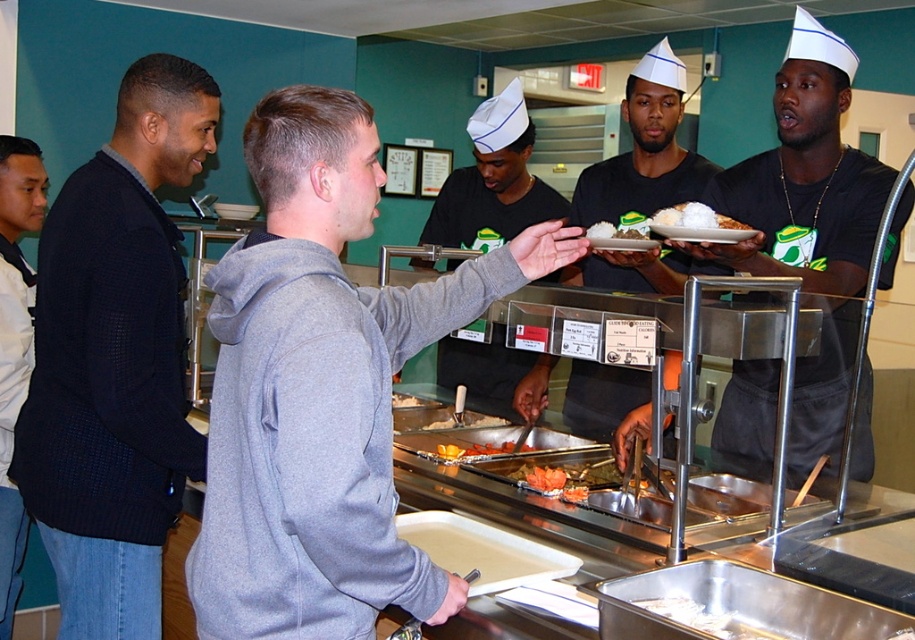
Which is above, orange glazed pastry at center or orange glazed carrots at center?

orange glazed pastry at center is above.

Locate an element on the screen. This screenshot has width=915, height=640. orange glazed pastry at center is located at coordinates (475, 451).

Is white shirt at left smaller than smooth orange carrot at center?

Actually, white shirt at left might be larger than smooth orange carrot at center.

Is point (11, 145) positioned after point (480, 413)?

No, it is in front of (480, 413).

You are a GUI agent. You are given a task and a screenshot of the screen. Output one action in this format:
    pyautogui.click(x=<x>, y=<y>)
    Task: Click on the white shirt at left
    
    Given the screenshot: What is the action you would take?
    pyautogui.click(x=15, y=344)

The width and height of the screenshot is (915, 640). I want to click on white shirt at left, so click(15, 344).

Is the position of white shirt at left more distant than that of orange glazed salmon at center?

That is True.

Is point (35, 220) positioned before point (558, 470)?

That is False.

Does point (3, 170) come in front of point (537, 477)?

No, (3, 170) is further to viewer.

Locate an element on the screen. white shirt at left is located at coordinates (15, 344).